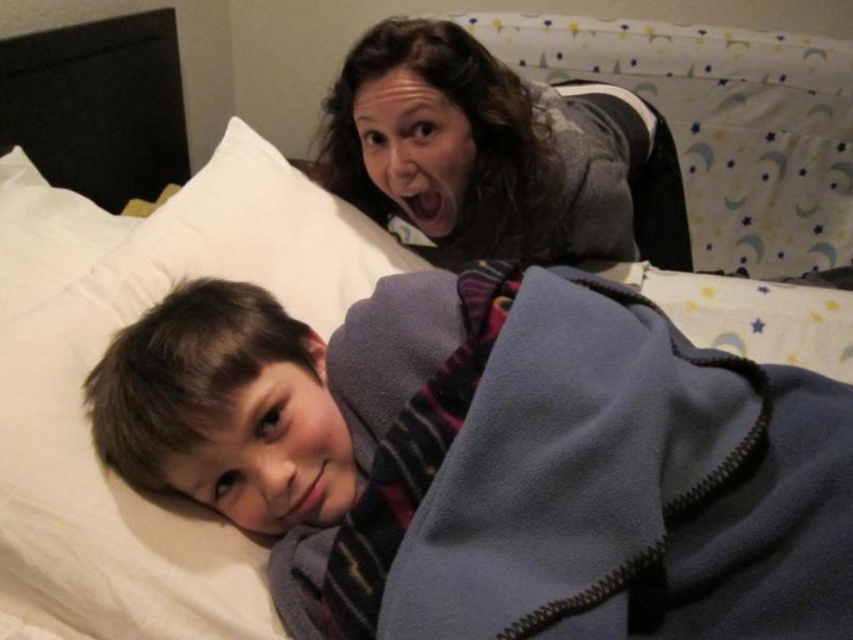
Question: Which point is farther from the camera taking this photo?

Choices:
 (A) (370, 145)
 (B) (282, 280)

Answer: (A)

Question: Considering the real-world distances, which object is closest to the gray fleece at upper center?

Choices:
 (A) white soft pillow at upper center
 (B) fleece at lower left

Answer: (A)

Question: Considering the relative positions of fleece at lower left and gray fleece at upper center in the image provided, where is fleece at lower left located with respect to gray fleece at upper center?

Choices:
 (A) right
 (B) left

Answer: (B)

Question: Which of the following is the farthest from the observer?

Choices:
 (A) (834, 449)
 (B) (137, 296)

Answer: (B)

Question: Does white soft pillow at upper center appear under gray fleece at upper center?

Choices:
 (A) yes
 (B) no

Answer: (A)

Question: Can you confirm if white soft pillow at upper center is smaller than gray fleece at upper center?

Choices:
 (A) no
 (B) yes

Answer: (B)